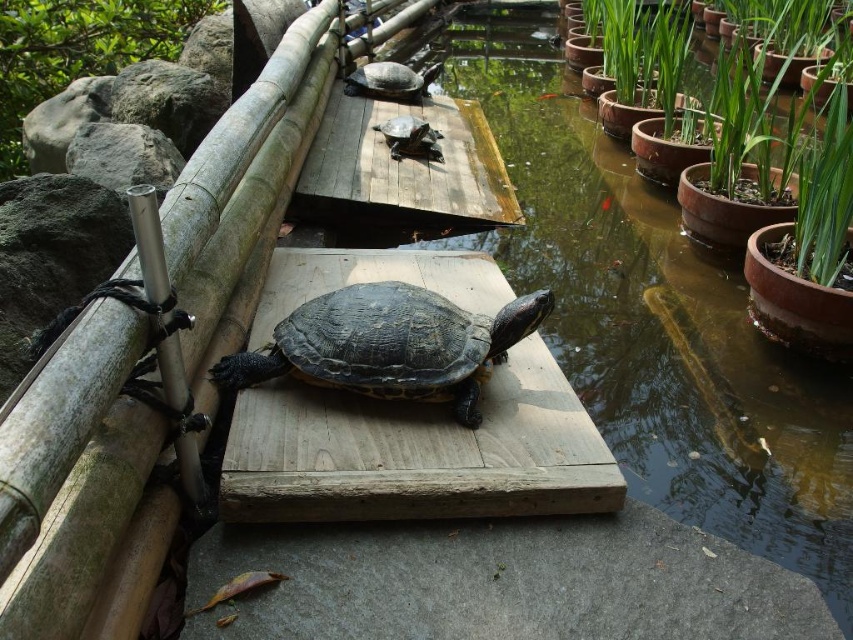
Question: Does brown wooden plank at center have a lesser width compared to green mossy rock at upper left?

Choices:
 (A) no
 (B) yes

Answer: (A)

Question: Among these points, which one is nearest to the camera?

Choices:
 (A) [x=227, y=513]
 (B) [x=827, y=161]
 (C) [x=387, y=93]
 (D) [x=42, y=76]

Answer: (A)

Question: Does green clay pot at right come behind shiny dark brown tortoise at center?

Choices:
 (A) no
 (B) yes

Answer: (B)

Question: Which object is positioned farthest from the green mossy rock at upper left?

Choices:
 (A) shiny dark brown tortoise at center
 (B) green clay pot at right
 (C) shiny brown tortoise at center
 (D) brown wooden plank at center

Answer: (B)

Question: Is brown wooden platform at center below brown wooden plank at center?

Choices:
 (A) no
 (B) yes

Answer: (A)

Question: Which of these objects is positioned closest to the green clay pot at right?

Choices:
 (A) shiny brown tortoise at center
 (B) shiny brown tortoise at upper center
 (C) brown wooden plank at center

Answer: (A)